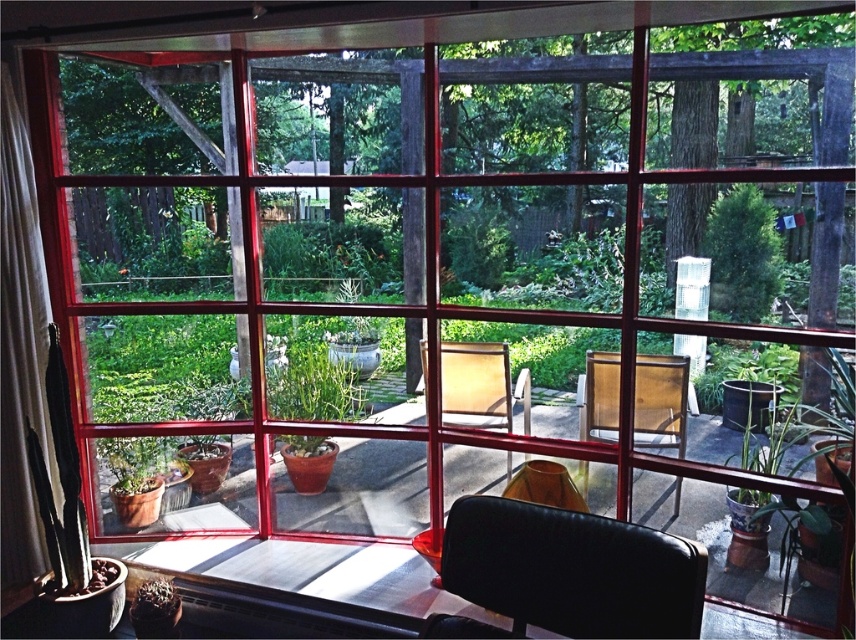
From the picture: Between black leather armchair at lower center and green leafy plant at upper right, which one is positioned lower?

black leather armchair at lower center

Locate an element on the screen. black leather armchair at lower center is located at coordinates (566, 573).

In order to click on black leather armchair at lower center in this screenshot , I will do `click(566, 573)`.

I want to click on white sheer curtain at left, so click(21, 349).

Which is below, white sheer curtain at left or matte yellow armchair at center?

Positioned lower is matte yellow armchair at center.

Between point (42, 284) and point (423, 360), which one is positioned behind?

Point (423, 360)

I want to click on white sheer curtain at left, so click(21, 349).

Where is `green leafy plant at upper right`? The image size is (856, 640). green leafy plant at upper right is located at coordinates (742, 253).

Is point (762, 218) behind point (474, 413)?

No.

Where is `green leafy plant at upper right`? The height and width of the screenshot is (640, 856). green leafy plant at upper right is located at coordinates (742, 253).